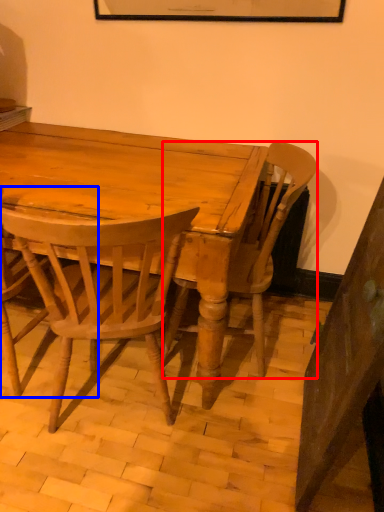
Question: Among these objects, which one is farthest to the camera, chair (highlighted by a red box) or chair (highlighted by a blue box)?

Choices:
 (A) chair
 (B) chair

Answer: (A)